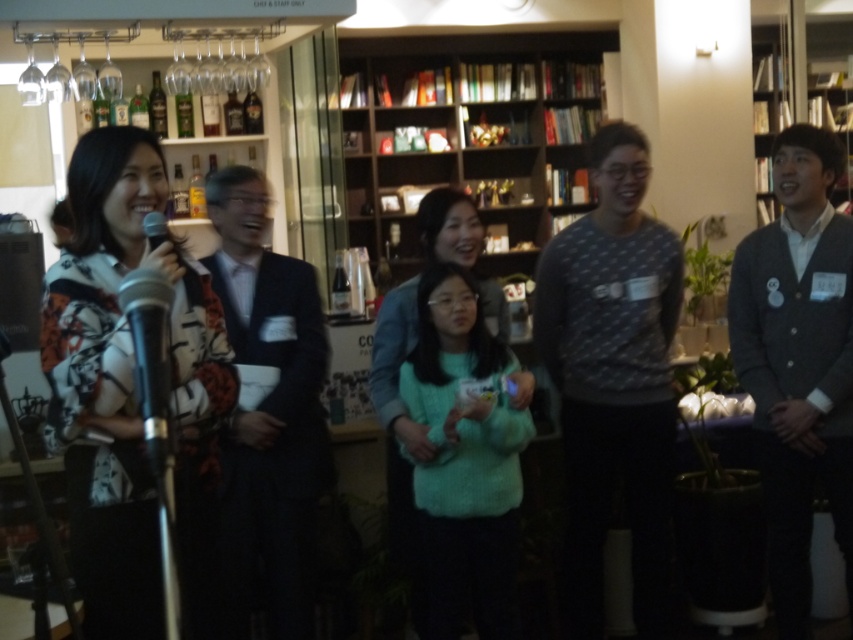
Who is shorter, dark gray suit at right or dark suit at center?

dark suit at center is shorter.

Does dark gray suit at right appear under dark suit at center?

Correct, dark gray suit at right is located below dark suit at center.

Identify the location of dark gray suit at right. click(798, 362).

Where is `dark gray suit at right`? The height and width of the screenshot is (640, 853). dark gray suit at right is located at coordinates tap(798, 362).

Between wooden bookshelf at center and dark gray suit at right, which one is positioned lower?

dark gray suit at right is lower down.

Based on the photo, who is taller, wooden bookshelf at center or dark gray suit at right?

Standing taller between the two is dark gray suit at right.

The width and height of the screenshot is (853, 640). Find the location of `wooden bookshelf at center`. wooden bookshelf at center is located at coordinates (474, 132).

Identify the location of wooden bookshelf at center. (474, 132).

Between point (560, 88) and point (271, 596), which one is positioned in front?

Positioned in front is point (271, 596).

Describe the element at coordinates (474, 132) in the screenshot. I see `wooden bookshelf at center` at that location.

Is point (368, 141) positioned behind point (276, 317)?

That is True.

Image resolution: width=853 pixels, height=640 pixels. Find the location of `wooden bookshelf at center`. wooden bookshelf at center is located at coordinates (474, 132).